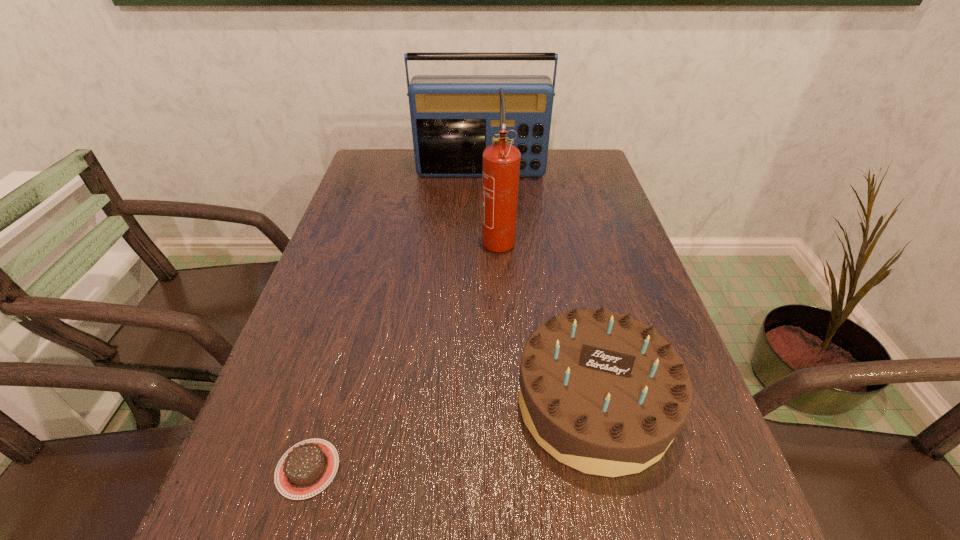
Identify the location of the second farthest object. (500, 162).

The width and height of the screenshot is (960, 540). Identify the location of the farthest object. (453, 117).

The height and width of the screenshot is (540, 960). I want to click on birthday cake, so click(603, 393).

The height and width of the screenshot is (540, 960). Identify the location of chocolate cake. (307, 468).

Image resolution: width=960 pixels, height=540 pixels. In order to click on the leftmost object in this screenshot , I will do `click(307, 468)`.

Locate an element on the screen. The height and width of the screenshot is (540, 960). free location located from the nozzle of the fire extinguisher is located at coordinates (502, 308).

In order to click on vacant region located on the front panel of the farthest object in this screenshot , I will do `click(481, 198)`.

Where is `vacant space situated on the front-facing side of the third tallest object`? The width and height of the screenshot is (960, 540). vacant space situated on the front-facing side of the third tallest object is located at coordinates (619, 515).

Locate an element on the screen. vacant region located 0.050m on the left of the leftmost object is located at coordinates (245, 469).

At what (x,y) coordinates should I click in order to perform the action: click on object located in the far edge section of the desktop. Please return your answer as a coordinate pair (x, y). This screenshot has width=960, height=540. Looking at the image, I should click on [x=453, y=117].